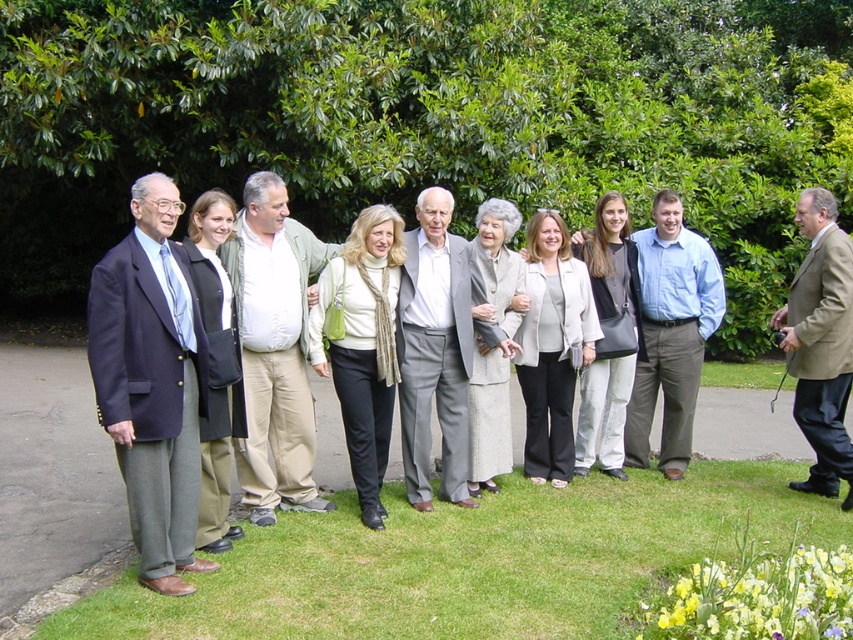
In the image, there are eleven people standing in a grassy area. The blue shirt at center is represented by point (671, 333). Which direction is the blue shirt at center facing relative to the group?

The blue shirt at center is facing towards the group.